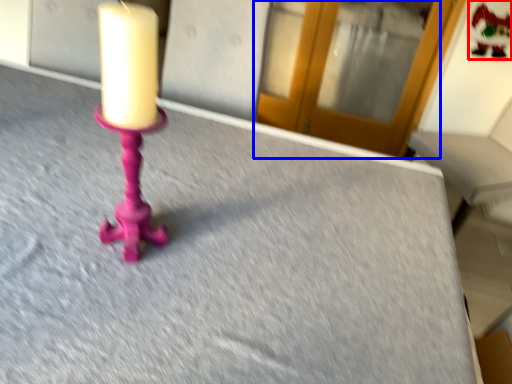
Question: Which point is closer to the camera, santa claus (highlighted by a red box) or glass door (highlighted by a blue box)?

Choices:
 (A) santa claus
 (B) glass door

Answer: (A)